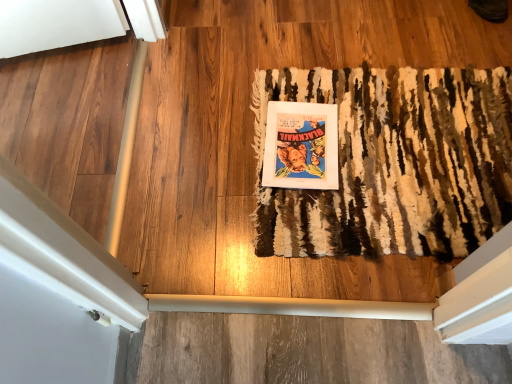
Find the location of a particular element. free space to the left of rug at center is located at coordinates (204, 162).